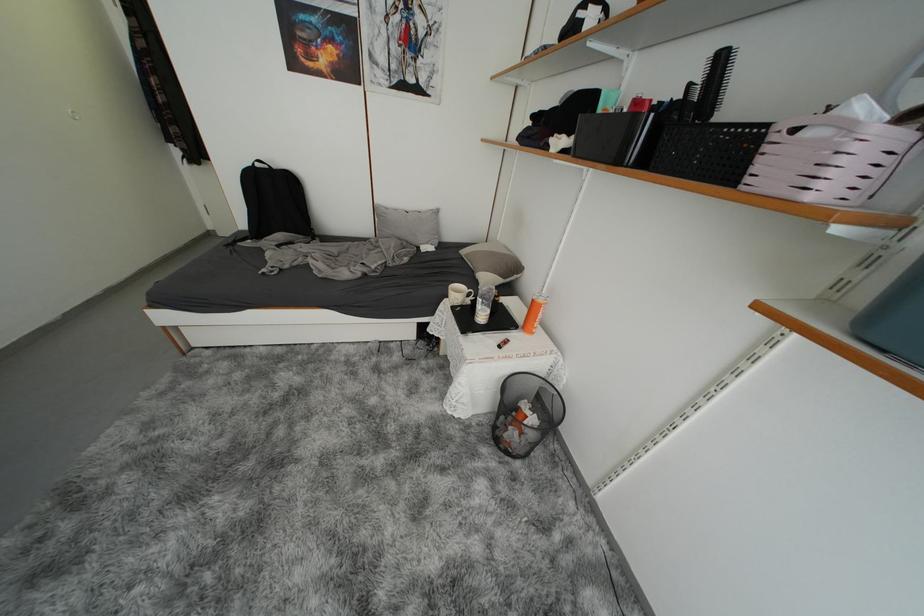
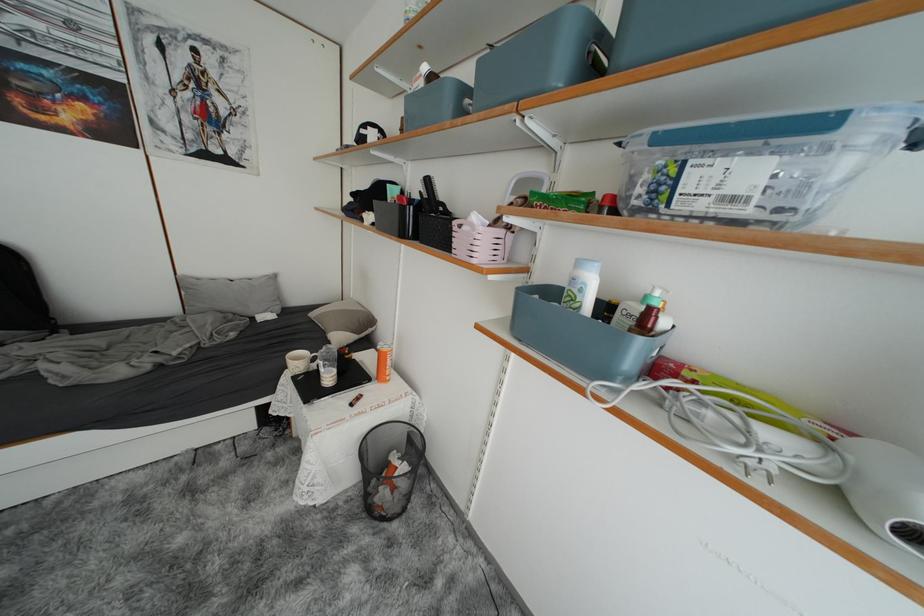
Question: I am providing you with two images of the same scene from different viewpoints. Please identify which objects are invisible in image2.

Choices:
 (A) container lid clip
 (B) black bottle
 (C) white bottle cap
 (D) none of these

Answer: (D)